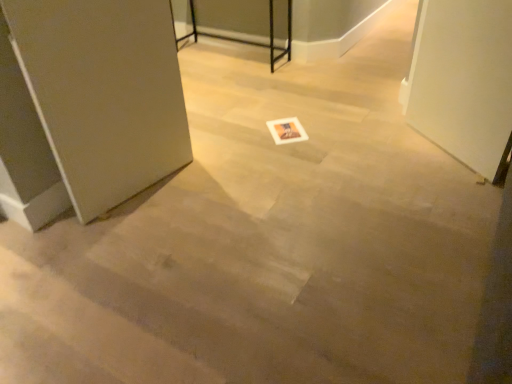
The height and width of the screenshot is (384, 512). Identify the location of spots to the right of white paper postcard at center. (320, 128).